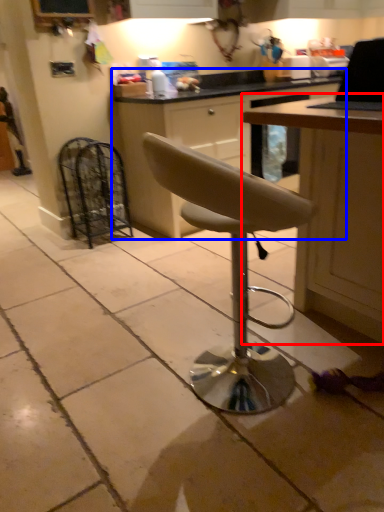
Question: Which object is further to the camera taking this photo, table (highlighted by a red box) or cabinetry (highlighted by a blue box)?

Choices:
 (A) table
 (B) cabinetry

Answer: (B)